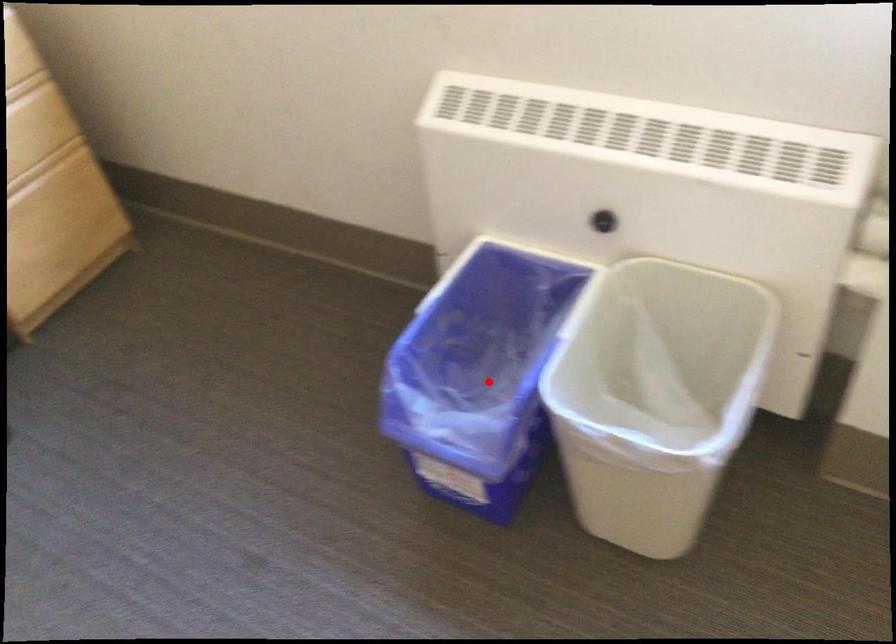
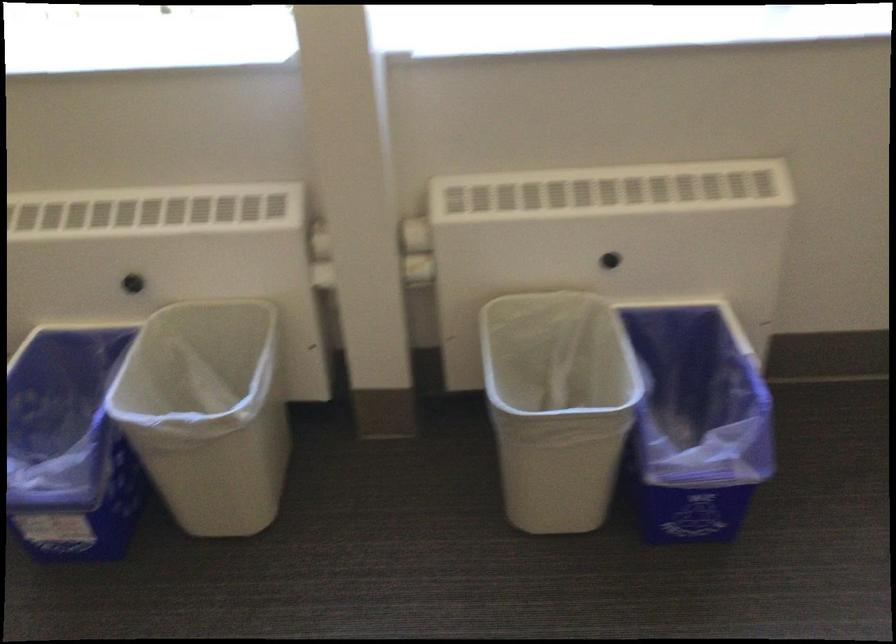
The point at the highlighted location is marked in the first image. Where is the corresponding point in the second image?

(70, 447)